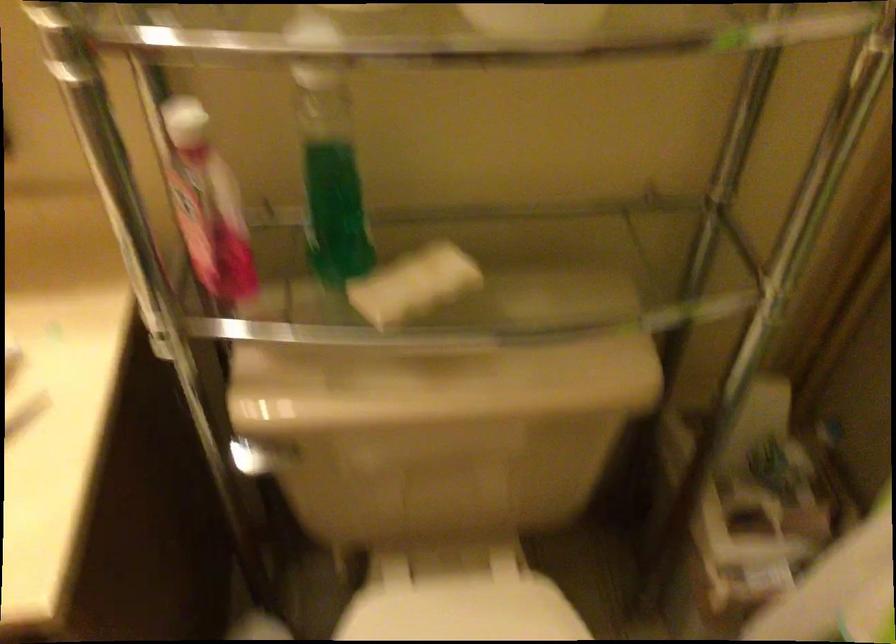
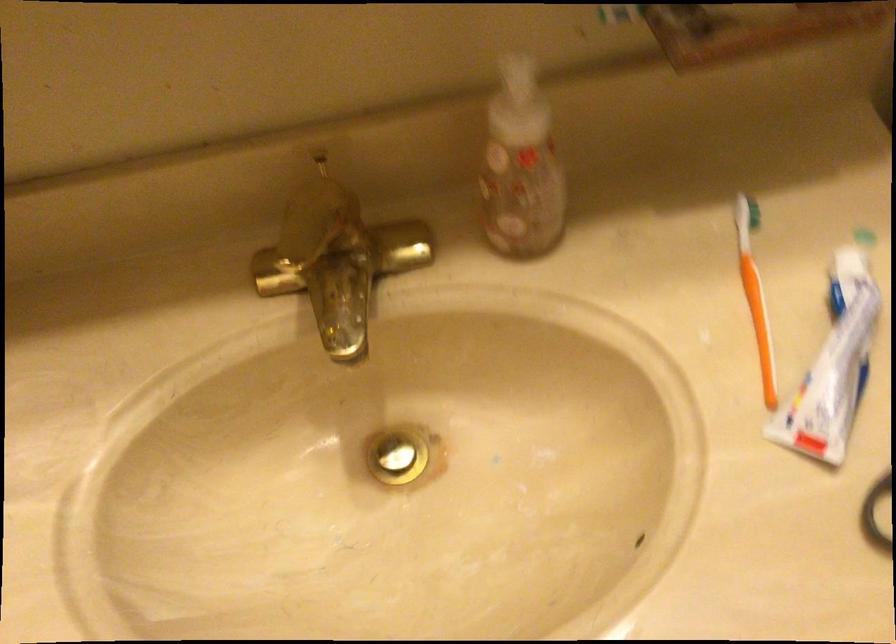
Question: Which direction would the cameraman need to move to produce the second image? Reply with the corresponding letter.

Choices:
 (A) Left
 (B) Right
 (C) Forward
 (D) Backward

Answer: (A)